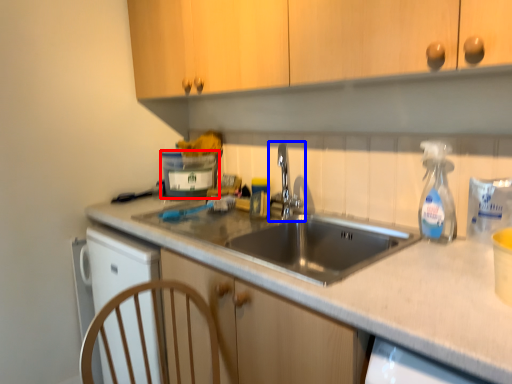
Question: Which of the following is the farthest to the observer, appliance (highlighted by a red box) or tap (highlighted by a blue box)?

Choices:
 (A) appliance
 (B) tap

Answer: (A)